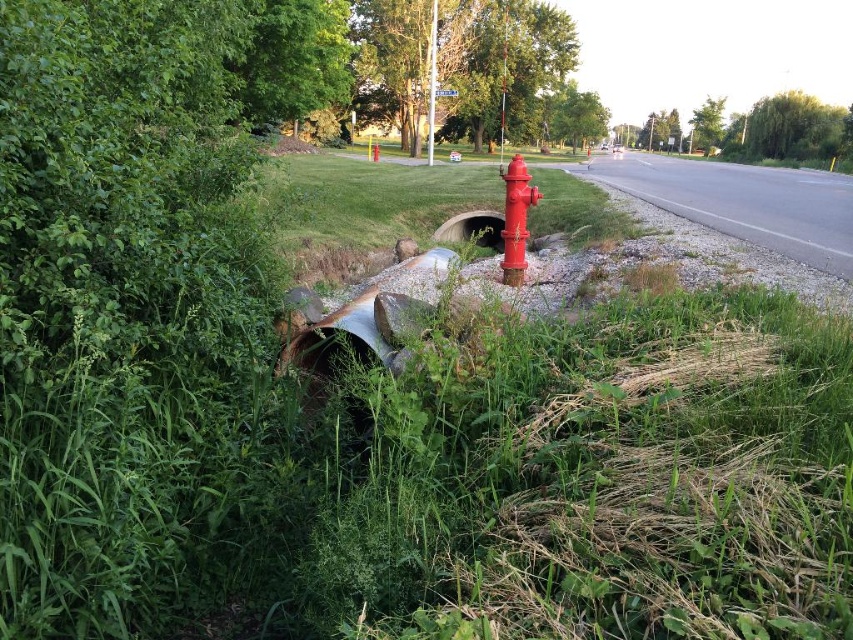
Is shiny red fire hydrant at center positioned in front of rusty metal pipe at center?

Yes, it is.

The image size is (853, 640). Describe the element at coordinates (515, 220) in the screenshot. I see `shiny red fire hydrant at center` at that location.

Locate an element on the screen. shiny red fire hydrant at center is located at coordinates (515, 220).